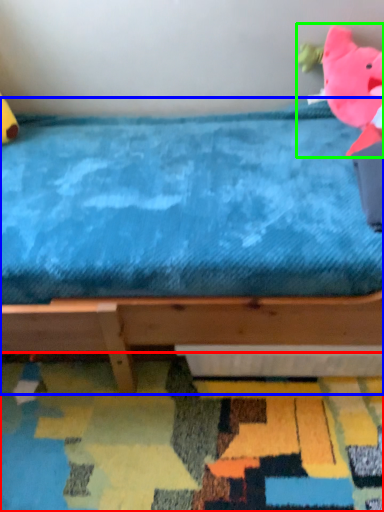
Question: Estimate the real-world distances between objects in this image. Which object is farther from mat (highlighted by a red box), bed (highlighted by a blue box) or toy (highlighted by a green box)?

Choices:
 (A) bed
 (B) toy

Answer: (B)